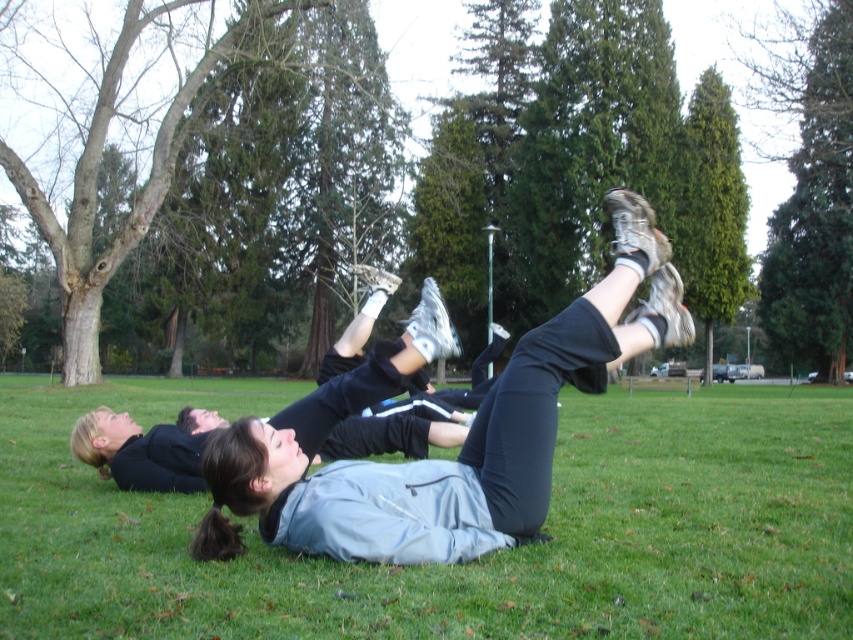
Question: In this image, where is green grass at center located relative to matte gray jacket at center?

Choices:
 (A) right
 (B) left

Answer: (B)

Question: Is green grass at center closer to the viewer compared to matte gray jacket at center?

Choices:
 (A) yes
 (B) no

Answer: (A)

Question: Does green grass at center have a larger size compared to matte gray jacket at center?

Choices:
 (A) no
 (B) yes

Answer: (B)

Question: Which object is closer to the camera taking this photo?

Choices:
 (A) matte gray jacket at center
 (B) green grass at center

Answer: (B)